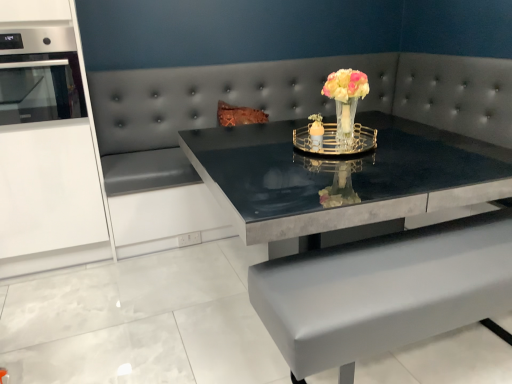
Question: From a real-world perspective, is stainless steel oven at left physically located above or below shiny black table at center?

Choices:
 (A) above
 (B) below

Answer: (A)

Question: Based on their positions, is stainless steel oven at left located to the left or right of shiny black table at center?

Choices:
 (A) right
 (B) left

Answer: (B)

Question: Which is nearer to the translucent glass vase at center?

Choices:
 (A) shiny black table at center
 (B) stainless steel oven at left

Answer: (A)

Question: Considering the real-world distances, which object is farthest from the stainless steel oven at left?

Choices:
 (A) translucent glass vase at center
 (B) shiny black table at center

Answer: (A)